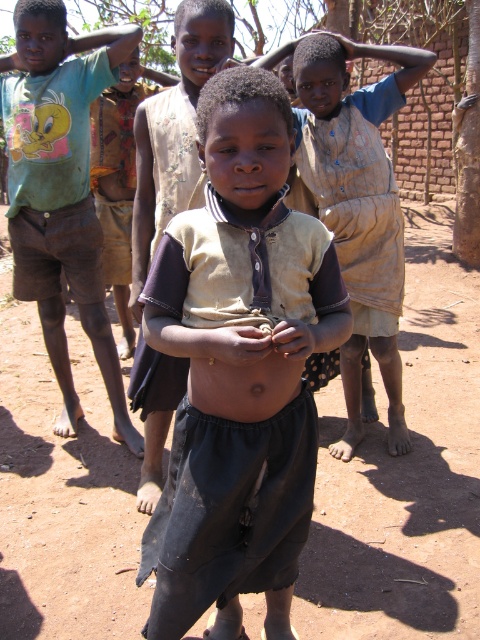
Who is lower down, dirt field at center or green t-shirt at left?

dirt field at center

Does dirt field at center appear on the left side of green t-shirt at left?

No, dirt field at center is not to the left of green t-shirt at left.

Does point (445, 216) come in front of point (85, 259)?

No.

Locate an element on the screen. Image resolution: width=480 pixels, height=640 pixels. dirt field at center is located at coordinates (406, 472).

Who is more distant from viewer, (415, 241) or (197, 330)?

Positioned behind is point (415, 241).

Consider the image. Is dirt field at center above skinny dark skin at center?

Actually, dirt field at center is below skinny dark skin at center.

In order to click on dirt field at center in this screenshot , I will do `click(406, 472)`.

Who is more distant from viewer, (203, 246) or (286, 356)?

Point (203, 246)

From the picture: Does dirty beige shirt at center have a larger size compared to skinny dark skin at center?

Yes.

Is point (224, 365) closer to viewer compared to point (240, 392)?

Yes, point (224, 365) is in front of point (240, 392).

Identify the location of dirty beige shirt at center. Image resolution: width=480 pixels, height=640 pixels. (239, 369).